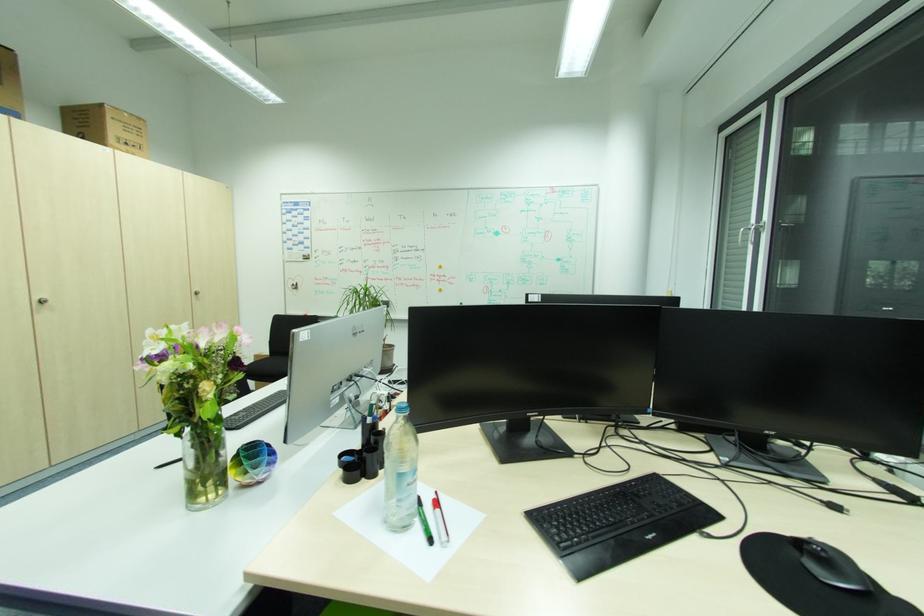
What do you see at coordinates (365, 447) in the screenshot? I see `the black pen holder` at bounding box center [365, 447].